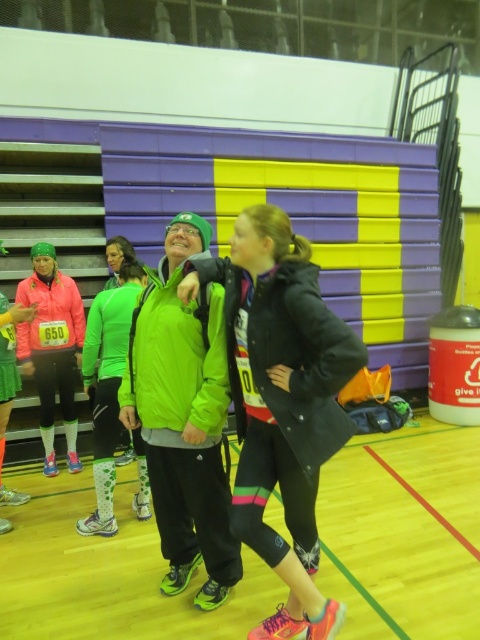
Is shiny black shoes at center taller than matte black jacket at center?

No, shiny black shoes at center is not taller than matte black jacket at center.

Who is more forward, (14, 637) or (272, 241)?

Point (272, 241) is more forward.

Locate an element on the screen. This screenshot has width=480, height=640. shiny black shoes at center is located at coordinates (404, 532).

Between point (406, 566) and point (44, 285), which one is positioned in front?

Positioned in front is point (406, 566).

Between shiny black shoes at center and matte pink jacket at center, which one is positioned lower?

shiny black shoes at center is below.

Looking at this image, who is more distant from viewer, (x=127, y=632) or (x=63, y=280)?

The point (x=63, y=280) is behind.

Locate an element on the screen. shiny black shoes at center is located at coordinates (404, 532).

Which is in front, point (299, 438) or point (41, 317)?

Point (299, 438) is in front.

Which is below, matte black jacket at center or matte pink jacket at center?

matte black jacket at center is lower down.

Which is behind, point (300, 618) or point (70, 394)?

Positioned behind is point (70, 394).

Locate an element on the screen. This screenshot has height=640, width=480. matte black jacket at center is located at coordinates (282, 401).